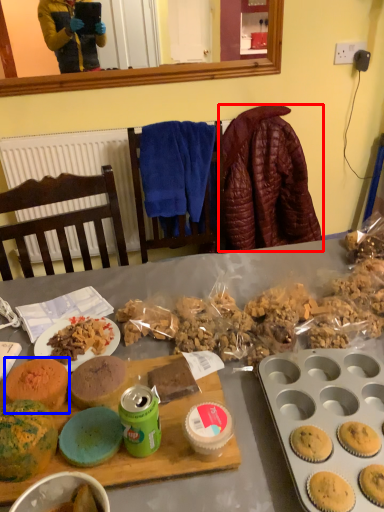
Question: Which object appears farthest to the camera in this image, blanket (highlighted by a red box) or snack (highlighted by a blue box)?

Choices:
 (A) blanket
 (B) snack

Answer: (A)